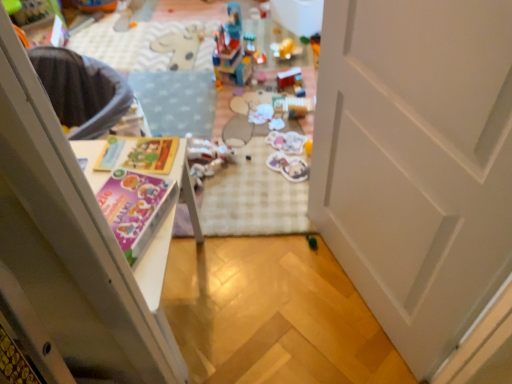
Locate an element on the screen. vacant location behind translucent plastic stickers at center, the 4th toy from the bottom is located at coordinates (270, 119).